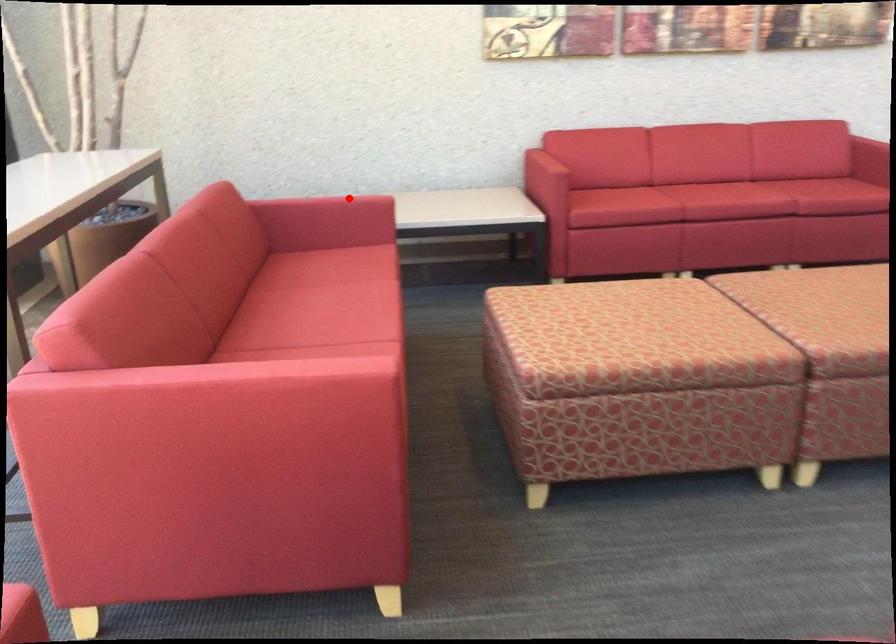
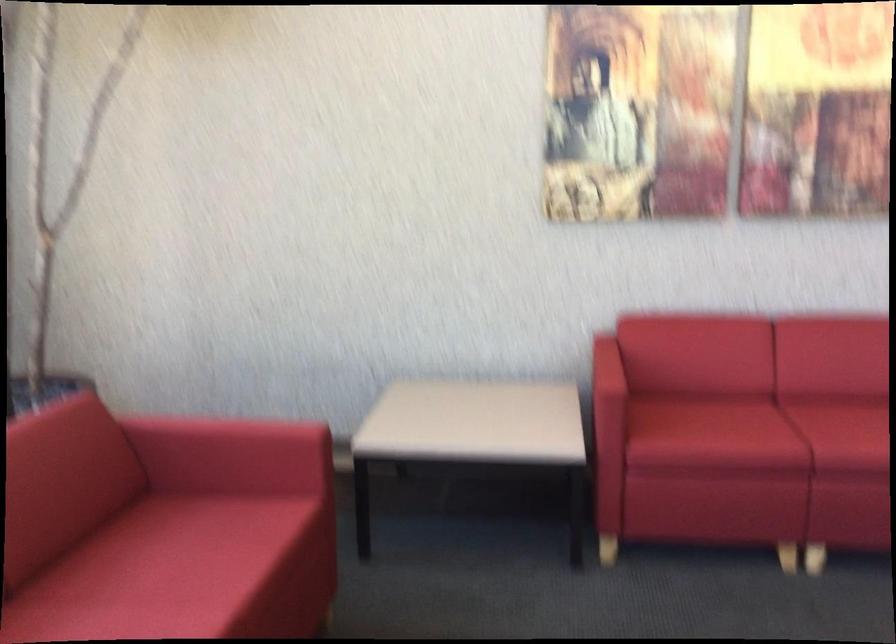
Question: I am providing you with two images of the same scene from different viewpoints. In image1, a red point is highlighted. Considering the same 3D point in image2, which of the following is correct?

Choices:
 (A) It is closer
 (B) It is farther

Answer: (A)